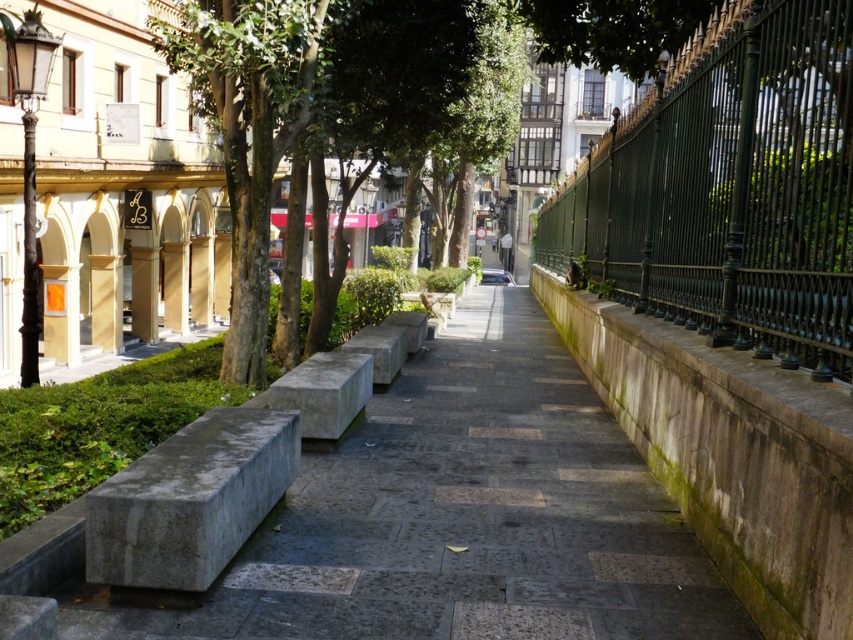
You are a delivery person with a 10 foot long package that needs to be carried through the space between the gray concrete bench at left and the fence on the right. Can you pass through the space without tilting the package?

The space between the gray concrete bench at left and the fence on the right is 11.65 feet wide, which is wider than the 10 foot long package. Therefore, you can pass through the space without tilting the package.

You are standing on the sidewalk in the scene and want to know where the green wrought iron fence at right is located. Can you determine its position based on the coordinates provided?

The green wrought iron fence at right is located at the 2D coordinate point of (730, 188).

Consider the image. You are a city planner assessing the space between the green leafy tree at upper left and the gray concrete bench at center. Which object takes up more space in the scene?

The green leafy tree at upper left is larger in size than the gray concrete bench at center, so it takes up more space in the scene.